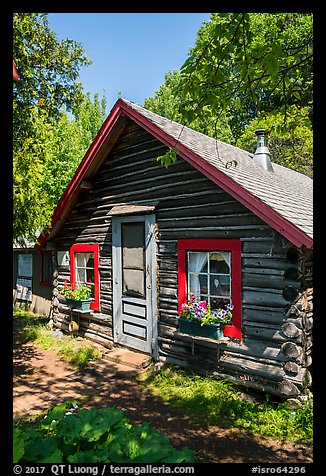
Find the location of a particular element. The height and width of the screenshot is (476, 326). white door is located at coordinates (148, 300).